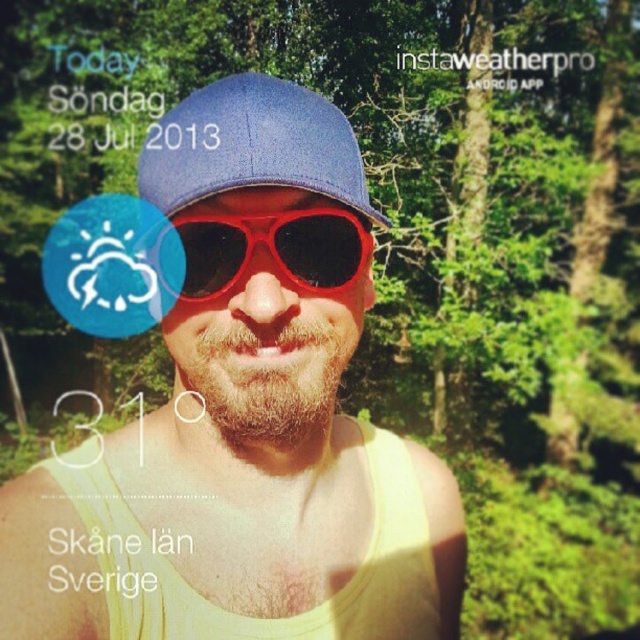
Question: Among these points, which one is farthest from the camera?

Choices:
 (A) (152, 163)
 (B) (326, 161)

Answer: (A)

Question: Does matte yellow tank top at center have a lesser width compared to shiny plastic goggles at center?

Choices:
 (A) no
 (B) yes

Answer: (A)

Question: Which object appears closest to the camera in this image?

Choices:
 (A) matte yellow tank top at center
 (B) shiny plastic goggles at center

Answer: (A)

Question: Can you confirm if matte yellow tank top at center is smaller than blue textured baseball cap at center?

Choices:
 (A) yes
 (B) no

Answer: (B)

Question: Which object is positioned closest to the blue textured baseball cap at center?

Choices:
 (A) matte yellow tank top at center
 (B) shiny plastic goggles at center

Answer: (B)

Question: Is matte yellow tank top at center smaller than blue textured baseball cap at center?

Choices:
 (A) no
 (B) yes

Answer: (A)